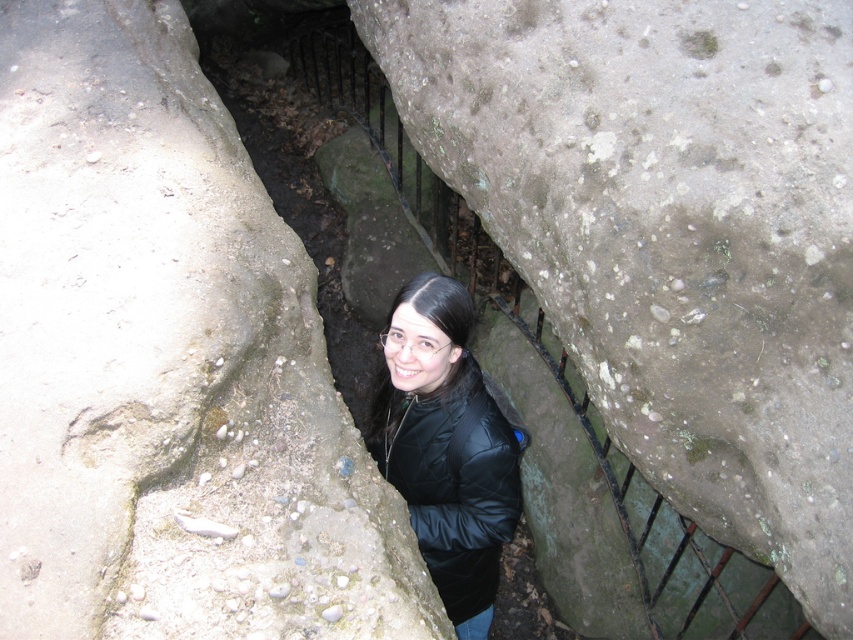
Question: Does rough textured rock at center appear under black quilted jacket at center?

Choices:
 (A) no
 (B) yes

Answer: (A)

Question: Which point is closer to the camera?

Choices:
 (A) (167, 440)
 (B) (683, 328)
 (C) (477, 604)

Answer: (A)

Question: From the image, what is the correct spatial relationship of rough textured rock at center in relation to black quilted jacket at center?

Choices:
 (A) left
 (B) right

Answer: (B)

Question: Considering the real-world distances, which object is closest to the black quilted jacket at center?

Choices:
 (A) rough textured rock at upper left
 (B) rough textured rock at center

Answer: (B)

Question: In this image, where is rough textured rock at center located relative to black quilted jacket at center?

Choices:
 (A) above
 (B) below

Answer: (A)

Question: Which of the following is the farthest from the observer?

Choices:
 (A) (131, 499)
 (B) (738, 365)

Answer: (B)